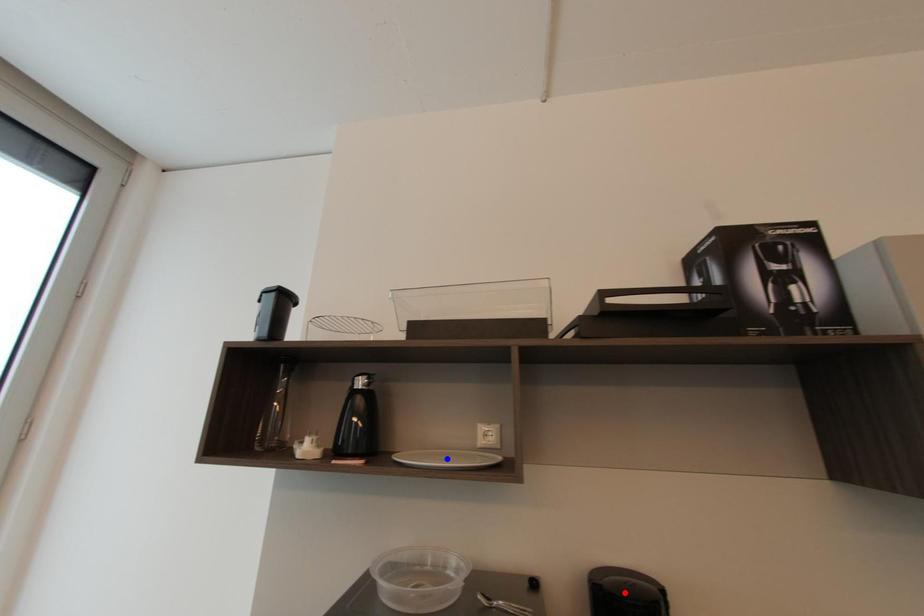
Question: Which of the two points in the image is closer to the camera?

Choices:
 (A) Blue point is closer.
 (B) Red point is closer.

Answer: (B)